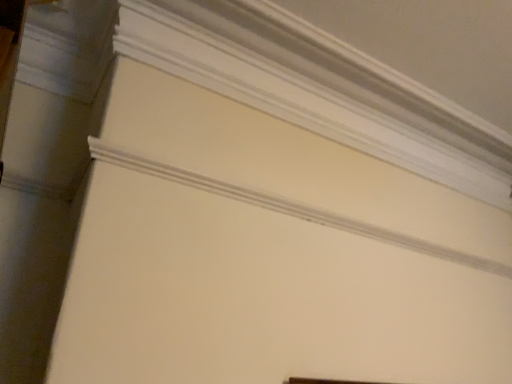
You are a GUI agent. You are given a task and a screenshot of the screen. Output one action in this format:
    pyautogui.click(x=<x>, y=<y>)
    Task: Click on the white smooth wood at upper center
    
    Given the screenshot: What is the action you would take?
    pyautogui.click(x=307, y=94)

What do you see at coordinates (307, 94) in the screenshot? Image resolution: width=512 pixels, height=384 pixels. I see `white smooth wood at upper center` at bounding box center [307, 94].

Identify the location of white smooth wood at upper center. (307, 94).